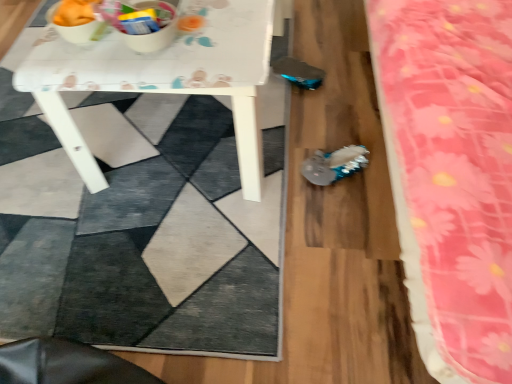
You are a GUI agent. You are given a task and a screenshot of the screen. Output one action in this format:
    pyautogui.click(x=<x>, y=<y>)
    Task: Click on the free space in front of shiny metallic shoe at center
    This screenshot has width=512, height=384.
    Given the screenshot: What is the action you would take?
    pyautogui.click(x=339, y=216)